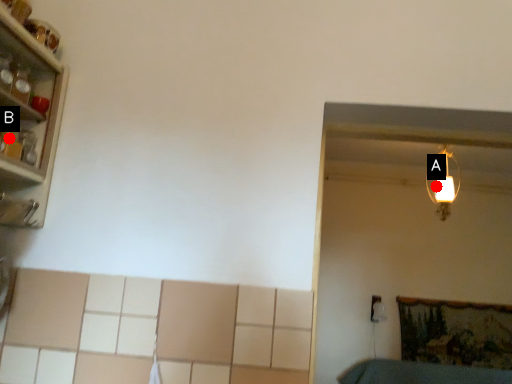
Question: Two points are circled on the image, labeled by A and B beside each circle. Which point appears closest to the camera in this image?

Choices:
 (A) A is closer
 (B) B is closer

Answer: (B)